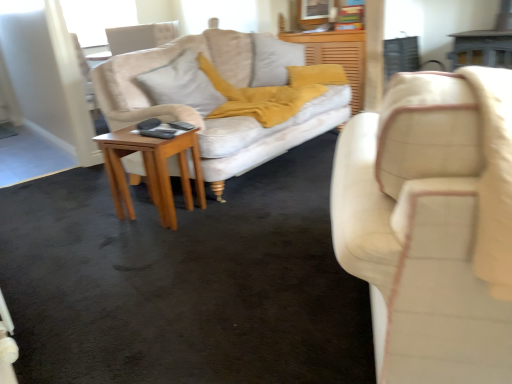
The width and height of the screenshot is (512, 384). What are the coordinates of `free space to the left of light brown wooden side table at center` in the screenshot? It's located at (89, 227).